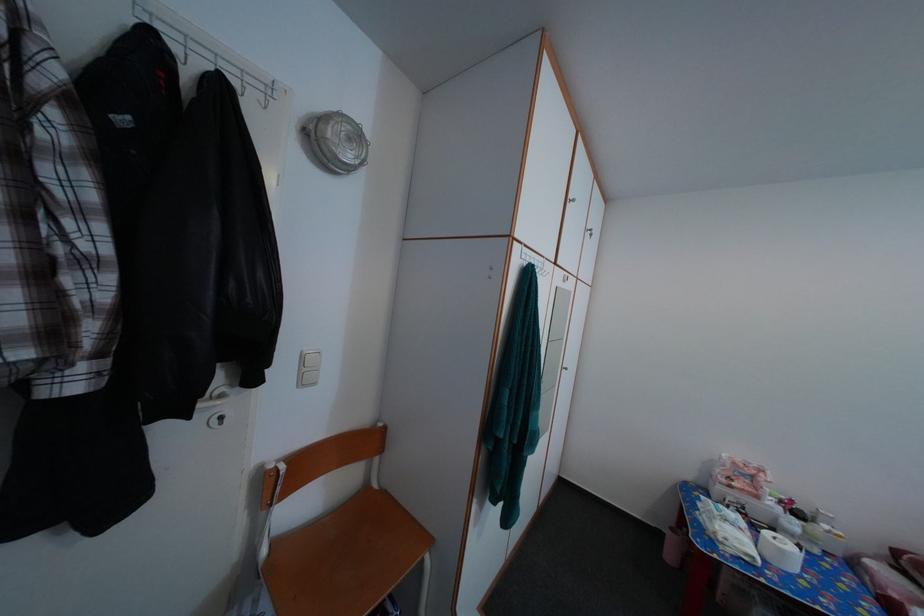
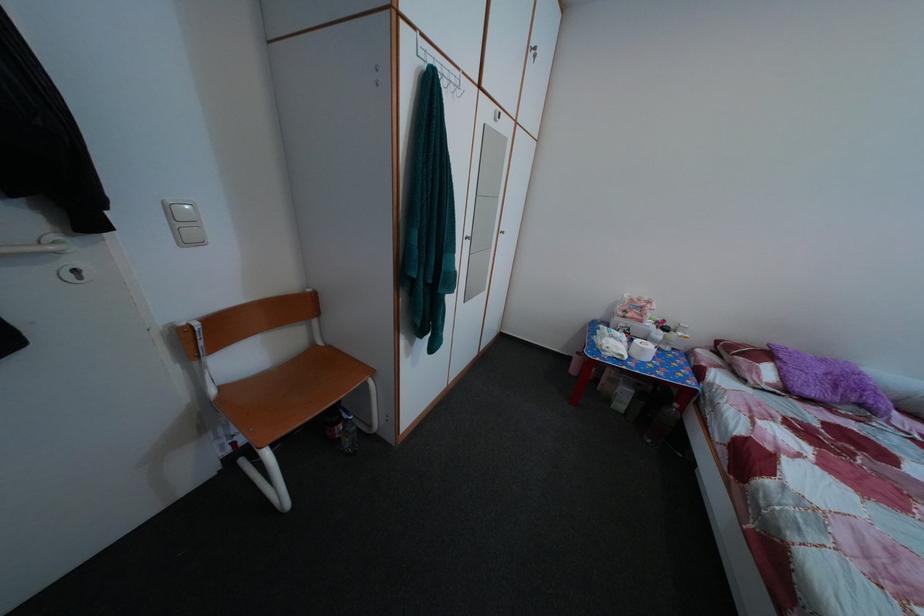
Question: The first image is from the beginning of the video and the second image is from the end. How did the camera likely rotate when shooting the video?

Choices:
 (A) Left
 (B) Right
 (C) Up
 (D) Down

Answer: (D)